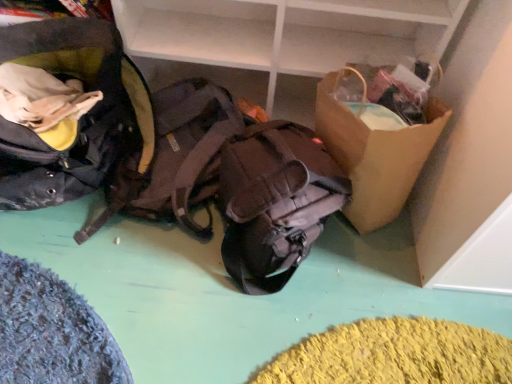
I want to click on vacant space situated on the left part of matte brown backpack at center, the 1th backpack viewed from the right, so click(x=148, y=276).